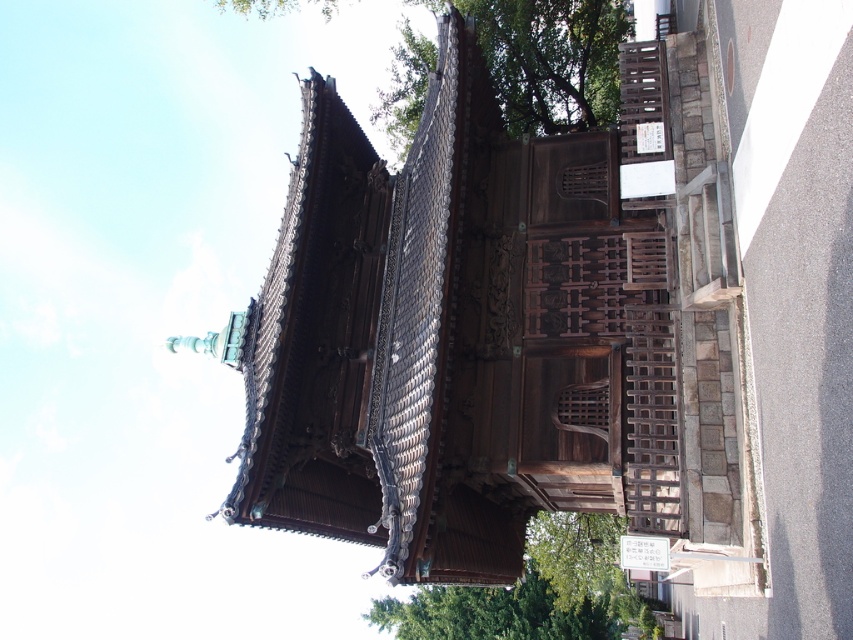
Does green leafy tree at upper center have a lesser height compared to green leafy tree at lower center?

In fact, green leafy tree at upper center may be taller than green leafy tree at lower center.

The width and height of the screenshot is (853, 640). What do you see at coordinates (552, 60) in the screenshot?
I see `green leafy tree at upper center` at bounding box center [552, 60].

Between point (503, 54) and point (494, 602), which one is positioned behind?

The point (494, 602) is behind.

Locate an element on the screen. This screenshot has width=853, height=640. green leafy tree at upper center is located at coordinates (552, 60).

From the picture: Is green leafy tree at lower left wider than green leafy tree at lower center?

Correct, the width of green leafy tree at lower left exceeds that of green leafy tree at lower center.

Is green leafy tree at lower left to the left of green leafy tree at lower center from the viewer's perspective?

No, green leafy tree at lower left is not to the left of green leafy tree at lower center.

Does point (547, 605) lie in front of point (422, 637)?

Yes, it is in front of point (422, 637).

The width and height of the screenshot is (853, 640). I want to click on green leafy tree at lower left, so click(x=534, y=593).

Which of these two, green leafy tree at upper center or green leafy tree at lower left, stands shorter?

With less height is green leafy tree at lower left.

Is green leafy tree at upper center to the left of green leafy tree at lower left from the viewer's perspective?

Indeed, green leafy tree at upper center is positioned on the left side of green leafy tree at lower left.

Locate an element on the screen. Image resolution: width=853 pixels, height=640 pixels. green leafy tree at upper center is located at coordinates (552, 60).